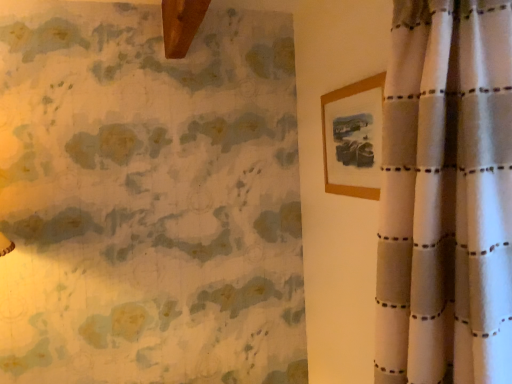
Looking at this image, what is the approximate width of wooden picture frame at upper right?

wooden picture frame at upper right is 1.43 inches in width.

The image size is (512, 384). What do you see at coordinates (353, 138) in the screenshot?
I see `wooden picture frame at upper right` at bounding box center [353, 138].

At what (x,y) coordinates should I click in order to perform the action: click on wooden picture frame at upper right. Please return your answer as a coordinate pair (x, y). This screenshot has width=512, height=384. Looking at the image, I should click on (353, 138).

Find the location of a particular element. This screenshot has height=384, width=512. wooden picture frame at upper right is located at coordinates (353, 138).